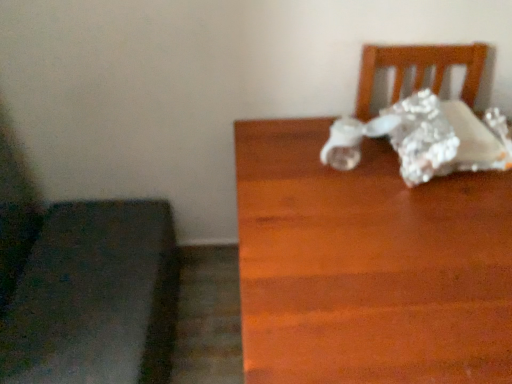
What are the coordinates of `wooden table at right` in the screenshot? It's located at (368, 266).

Describe the element at coordinates (368, 266) in the screenshot. The width and height of the screenshot is (512, 384). I see `wooden table at right` at that location.

Find the location of a particular element. dark gray fabric cushion at lower left is located at coordinates (95, 298).

The width and height of the screenshot is (512, 384). Describe the element at coordinates (95, 298) in the screenshot. I see `dark gray fabric cushion at lower left` at that location.

From the picture: What is the approximate height of dark gray fabric cushion at lower left?

dark gray fabric cushion at lower left is 14.95 inches tall.

What is the approximate width of dark gray fabric cushion at lower left?

dark gray fabric cushion at lower left is 16.24 inches in width.

Where is `wooden table at right`? This screenshot has height=384, width=512. wooden table at right is located at coordinates (368, 266).

Can you confirm if wooden table at right is positioned to the left of dark gray fabric cushion at lower left?

Incorrect, wooden table at right is not on the left side of dark gray fabric cushion at lower left.

Relative to dark gray fabric cushion at lower left, is wooden table at right in front or behind?

Visually, wooden table at right is located in front of dark gray fabric cushion at lower left.

Is point (267, 177) farther from viewer compared to point (90, 297)?

No, (267, 177) is closer to viewer.

From the image's perspective, does wooden table at right appear lower than dark gray fabric cushion at lower left?

No, from the image's perspective, wooden table at right is not beneath dark gray fabric cushion at lower left.

From a real-world perspective, which is physically above, wooden table at right or dark gray fabric cushion at lower left?

wooden table at right.

Considering the relative sizes of wooden table at right and dark gray fabric cushion at lower left in the image provided, is wooden table at right wider than dark gray fabric cushion at lower left?

Correct, the width of wooden table at right exceeds that of dark gray fabric cushion at lower left.

Is wooden table at right taller or shorter than dark gray fabric cushion at lower left?

wooden table at right is taller than dark gray fabric cushion at lower left.

Which of these two, wooden table at right or dark gray fabric cushion at lower left, is bigger?

Bigger between the two is wooden table at right.

Choose the correct answer: Is wooden table at right inside dark gray fabric cushion at lower left or outside it?

wooden table at right is spatially situated outside dark gray fabric cushion at lower left.

In the scene shown: Would you say wooden table at right is a long distance from dark gray fabric cushion at lower left?

That's not correct — wooden table at right is a little close to dark gray fabric cushion at lower left.

Is wooden table at right oriented towards dark gray fabric cushion at lower left?

No.

Can you tell me how much wooden table at right and dark gray fabric cushion at lower left differ in facing direction?

89.2 degrees.

Where is `furniture behind the wooden table at right`? furniture behind the wooden table at right is located at coordinates (95, 298).

Is dark gray fabric cushion at lower left at the right side of wooden table at right?

In fact, dark gray fabric cushion at lower left is to the left of wooden table at right.

Which object is further away from the camera taking this photo, dark gray fabric cushion at lower left or wooden table at right?

dark gray fabric cushion at lower left is behind.

Is point (67, 355) positioned before point (290, 251)?

No, it is behind (290, 251).

From the image's perspective, is dark gray fabric cushion at lower left located above or below wooden table at right?

Clearly, from the image's perspective, dark gray fabric cushion at lower left is below wooden table at right.

From a real-world perspective, does dark gray fabric cushion at lower left stand above wooden table at right?

No, from a real-world perspective, dark gray fabric cushion at lower left is not above wooden table at right.

Looking at this image, can you confirm if dark gray fabric cushion at lower left is thinner than wooden table at right?

Yes.

Considering the sizes of dark gray fabric cushion at lower left and wooden table at right in the image, is dark gray fabric cushion at lower left taller or shorter than wooden table at right?

Clearly, dark gray fabric cushion at lower left is shorter compared to wooden table at right.

Is dark gray fabric cushion at lower left smaller than wooden table at right?

Yes, dark gray fabric cushion at lower left is smaller than wooden table at right.

Would you say dark gray fabric cushion at lower left is outside wooden table at right?

Absolutely, dark gray fabric cushion at lower left is external to wooden table at right.

Is dark gray fabric cushion at lower left far away from wooden table at right?

That's not correct — dark gray fabric cushion at lower left is a little close to wooden table at right.

Does dark gray fabric cushion at lower left turn towards wooden table at right?

Yes, dark gray fabric cushion at lower left is turned towards wooden table at right.

In order to click on furniture directly beneath the wooden table at right (from a real-world perspective) in this screenshot , I will do `click(95, 298)`.

Locate an element on the screen. Image resolution: width=512 pixels, height=384 pixels. furniture below the wooden table at right (from a real-world perspective) is located at coordinates (95, 298).

The width and height of the screenshot is (512, 384). I want to click on table on the right of dark gray fabric cushion at lower left, so click(x=368, y=266).